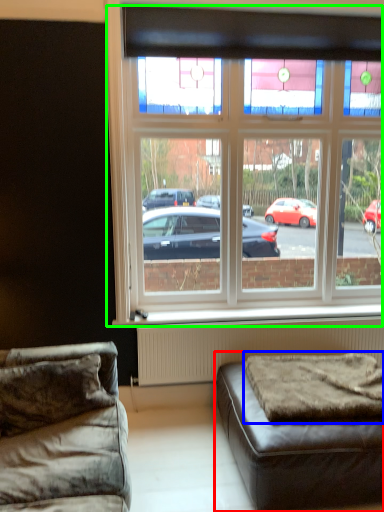
Question: Based on their relative distances, which object is nearer to studio couch (highlighted by a red box)? Choose from mattress (highlighted by a blue box) and window (highlighted by a green box).

Choices:
 (A) mattress
 (B) window

Answer: (A)